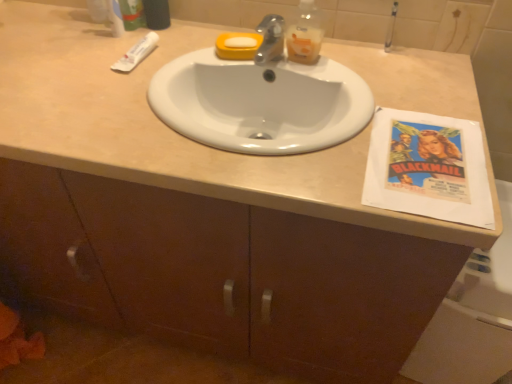
The image size is (512, 384). In order to click on vacant area located to the right-hand side of white matte tube at upper left in this screenshot , I will do `click(187, 51)`.